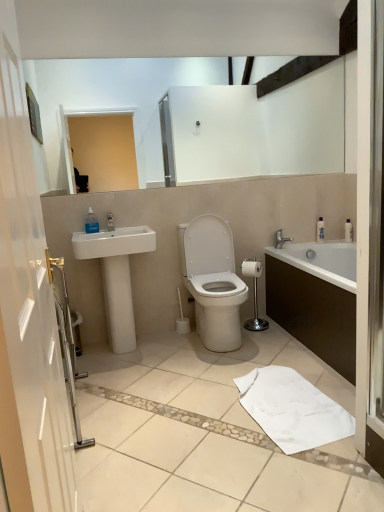
In order to click on clear plastic soap dispenser at upper left in this screenshot , I will do `click(91, 222)`.

What do you see at coordinates (91, 222) in the screenshot? I see `clear plastic soap dispenser at upper left` at bounding box center [91, 222].

Identify the location of transparent glass screen door at right. (376, 248).

The height and width of the screenshot is (512, 384). What are the coordinates of `white cotton bath towel at lower center` in the screenshot? It's located at (292, 409).

Describe the element at coordinates (292, 409) in the screenshot. The image size is (384, 512). I see `white cotton bath towel at lower center` at that location.

In order to face white glossy toilet at center, should I rotate leftwards or rightwards?

Answer: To align with it, rotate right about 3.222°.

This screenshot has height=512, width=384. What are the coordinates of `chrome metallic toilet paper holder at center` in the screenshot? It's located at (254, 294).

Between white cotton bath towel at lower center and white glossy toilet at center, which one has larger width?

white glossy toilet at center.

Considering the relative sizes of white cotton bath towel at lower center and white glossy toilet at center in the image provided, is white cotton bath towel at lower center taller than white glossy toilet at center?

No, white cotton bath towel at lower center is not taller than white glossy toilet at center.

From a real-world perspective, is white cotton bath towel at lower center on top of white glossy toilet at center?

No, from a real-world perspective, white cotton bath towel at lower center is not above white glossy toilet at center.

Does point (298, 386) lie behind point (197, 294)?

No, (298, 386) is in front of (197, 294).

Who is bigger, transparent glass screen door at right or white cotton bath towel at lower center?

transparent glass screen door at right is bigger.

Which of these two, transparent glass screen door at right or white cotton bath towel at lower center, stands shorter?

Standing shorter between the two is white cotton bath towel at lower center.

Which is more to the right, transparent glass screen door at right or white cotton bath towel at lower center?

From the viewer's perspective, transparent glass screen door at right appears more on the right side.

The image size is (384, 512). Find the location of `screen door above the white cotton bath towel at lower center (from a real-world perspective)`. screen door above the white cotton bath towel at lower center (from a real-world perspective) is located at coordinates (376, 248).

Considering the sizes of clear plastic soap dispenser at upper left and white matte toilet paper at center in the image, is clear plastic soap dispenser at upper left taller or shorter than white matte toilet paper at center?

Clearly, clear plastic soap dispenser at upper left is taller compared to white matte toilet paper at center.

Relative to white matte toilet paper at center, is clear plastic soap dispenser at upper left in front or behind?

clear plastic soap dispenser at upper left is in front of white matte toilet paper at center.

Is clear plastic soap dispenser at upper left far from white matte toilet paper at center?

Yes, clear plastic soap dispenser at upper left is far from white matte toilet paper at center.

Can you confirm if clear plastic soap dispenser at upper left is wider than white glossy sink at left?

In fact, clear plastic soap dispenser at upper left might be narrower than white glossy sink at left.

Can you see clear plastic soap dispenser at upper left touching white glossy sink at left?

clear plastic soap dispenser at upper left and white glossy sink at left are clearly separated.

Is white glossy sink at left a part of clear plastic soap dispenser at upper left?

Actually, white glossy sink at left is outside clear plastic soap dispenser at upper left.

Is point (92, 219) closer or farther from the camera than point (113, 343)?

Point (92, 219) is farther from the camera than point (113, 343).

Would you say white glossy sink at left is a long distance from white glossy bathtub at right?

Yes.

The image size is (384, 512). What are the coordinates of `sink that appears behind the white glossy bathtub at right` in the screenshot? It's located at (116, 276).

Is white glossy sink at left taller or shorter than white glossy bathtub at right?

white glossy sink at left is taller than white glossy bathtub at right.

Consider the image. Can you confirm if white cotton bath towel at lower center is thinner than white glossy sink at left?

Incorrect, the width of white cotton bath towel at lower center is not less than that of white glossy sink at left.

From a real-world perspective, is white cotton bath towel at lower center above or below white glossy sink at left?

white cotton bath towel at lower center is situated lower than white glossy sink at left in the real world.

Consider the image. From the image's perspective, relative to white glossy sink at left, is white cotton bath towel at lower center above or below?

Based on their image positions, white cotton bath towel at lower center is located beneath white glossy sink at left.

Would you say chrome metallic toilet paper holder at center is to the left or to the right of white cotton bath towel at lower center in the picture?

chrome metallic toilet paper holder at center is positioned on white cotton bath towel at lower center's left side.

Can you confirm if chrome metallic toilet paper holder at center is wider than white cotton bath towel at lower center?

No, chrome metallic toilet paper holder at center is not wider than white cotton bath towel at lower center.

From their relative heights in the image, would you say chrome metallic toilet paper holder at center is taller or shorter than white cotton bath towel at lower center?

chrome metallic toilet paper holder at center is taller than white cotton bath towel at lower center.

Find the location of a particular element. bath towel located below the white glossy toilet at center (from the image's perspective) is located at coordinates tap(292, 409).

You are a GUI agent. You are given a task and a screenshot of the screen. Output one action in this format:
    pyautogui.click(x=<x>, y=<y>)
    Task: Click on the screen door that is on the right side of white cotton bath towel at lower center
    The height and width of the screenshot is (512, 384).
    Given the screenshot: What is the action you would take?
    pyautogui.click(x=376, y=248)

Considering their positions, is white matte toilet paper at center positioned closer to white glossy bathtub at right than chrome metallic toilet paper holder at center?

chrome metallic toilet paper holder at center lies closer to white glossy bathtub at right than the other object.

From the image, which object appears to be nearer to clear plastic soap dispenser at upper left, white cotton bath towel at lower center or silver metallic faucet at upper right?

The object closer to clear plastic soap dispenser at upper left is silver metallic faucet at upper right.

From the image, which object appears to be nearer to white glossy bathtub at right, white glossy toilet at center or clear plastic soap dispenser at upper left?

white glossy toilet at center.

Based on their spatial positions, is silver metallic faucet at upper right or white glossy toilet at center further from white cotton bath towel at lower center?

Among the two, silver metallic faucet at upper right is located further to white cotton bath towel at lower center.

Based on their spatial positions, is white glossy toilet at center or white glossy bathtub at right further from white cotton bath towel at lower center?

white glossy toilet at center.

When comparing their distances from silver metallic faucet at upper right, does chrome metallic toilet paper holder at center or white glossy sink at left seem further?

Answer: Among the two, white glossy sink at left is located further to silver metallic faucet at upper right.

When comparing their distances from white glossy toilet at center, does white glossy sink at left or white cotton bath towel at lower center seem closer?

white glossy sink at left lies closer to white glossy toilet at center than the other object.

Looking at the image, which one is located further to white glossy sink at left, white matte toilet paper at center or silver metallic faucet at upper right?

silver metallic faucet at upper right is further to white glossy sink at left.

Find the location of a particular element. This screenshot has height=512, width=384. bath towel situated between white glossy toilet at center and white glossy bathtub at right from left to right is located at coordinates (292, 409).

Find the location of `toilet paper between white glossy sink at left and white glossy bathtub at right in the horizontal direction`. toilet paper between white glossy sink at left and white glossy bathtub at right in the horizontal direction is located at coordinates (251, 268).

Where is `bath towel between transparent glass screen door at right and white matte toilet paper at center in the front-back direction`? The height and width of the screenshot is (512, 384). bath towel between transparent glass screen door at right and white matte toilet paper at center in the front-back direction is located at coordinates (292, 409).

At what (x,y) coordinates should I click in order to perform the action: click on shower positioned between white cotton bath towel at lower center and white matte toilet paper at center from near to far. Please return your answer as a coordinate pair (x, y). Looking at the image, I should click on (254, 294).